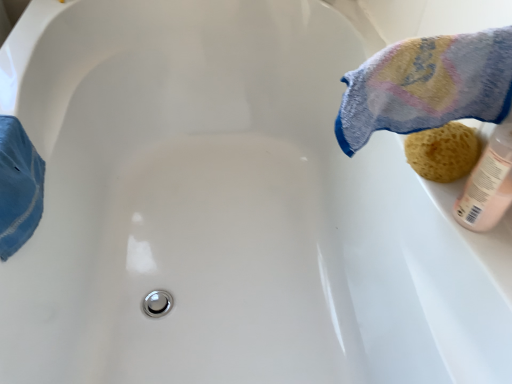
What is the approximate width of yellow sponge at right?

The width of yellow sponge at right is 9.50 centimeters.

This screenshot has width=512, height=384. In order to click on yellow sponge at right in this screenshot , I will do `click(443, 152)`.

What do you see at coordinates (443, 152) in the screenshot? The width and height of the screenshot is (512, 384). I see `yellow sponge at right` at bounding box center [443, 152].

Find the location of a particular element. Image resolution: width=512 pixels, height=384 pixels. multicolored terry cloth towel at upper right is located at coordinates (426, 86).

What do you see at coordinates (426, 86) in the screenshot?
I see `multicolored terry cloth towel at upper right` at bounding box center [426, 86].

Find the location of a particular element. Image resolution: width=512 pixels, height=384 pixels. yellow sponge at right is located at coordinates (443, 152).

Considering the relative positions of yellow sponge at right and multicolored terry cloth towel at upper right in the image provided, is yellow sponge at right to the right of multicolored terry cloth towel at upper right from the viewer's perspective?

Indeed, yellow sponge at right is positioned on the right side of multicolored terry cloth towel at upper right.

Considering their positions, is yellow sponge at right located in front of or behind multicolored terry cloth towel at upper right?

In the image, yellow sponge at right appears behind multicolored terry cloth towel at upper right.

Considering the positions of point (438, 163) and point (383, 121), is point (438, 163) closer or farther from the camera than point (383, 121)?

Point (438, 163).

From the image's perspective, relative to multicolored terry cloth towel at upper right, is yellow sponge at right above or below?

Based on their image positions, yellow sponge at right is located beneath multicolored terry cloth towel at upper right.

From a real-world perspective, is yellow sponge at right on multicolored terry cloth towel at upper right?

Actually, yellow sponge at right is physically below multicolored terry cloth towel at upper right in the real world.

Considering the sizes of objects yellow sponge at right and multicolored terry cloth towel at upper right in the image provided, who is wider, yellow sponge at right or multicolored terry cloth towel at upper right?

multicolored terry cloth towel at upper right.

Can you confirm if yellow sponge at right is taller than multicolored terry cloth towel at upper right?

In fact, yellow sponge at right may be shorter than multicolored terry cloth towel at upper right.

Can you confirm if yellow sponge at right is bigger than multicolored terry cloth towel at upper right?

Incorrect, yellow sponge at right is not larger than multicolored terry cloth towel at upper right.

Is multicolored terry cloth towel at upper right surrounded by yellow sponge at right?

No, yellow sponge at right does not contain multicolored terry cloth towel at upper right.

Is yellow sponge at right far from multicolored terry cloth towel at upper right?

No, yellow sponge at right is not far from multicolored terry cloth towel at upper right.

Is yellow sponge at right aimed at multicolored terry cloth towel at upper right?

No.

Find the location of a particular element. stuff that appears on the right of multicolored terry cloth towel at upper right is located at coordinates (443, 152).

Considering the positions of objects multicolored terry cloth towel at upper right and yellow sponge at right in the image provided, who is more to the right, multicolored terry cloth towel at upper right or yellow sponge at right?

From the viewer's perspective, yellow sponge at right appears more on the right side.

Is multicolored terry cloth towel at upper right positioned in front of yellow sponge at right?

Yes, it is.

Considering the positions of points (440, 43) and (452, 158), is point (440, 43) closer to camera compared to point (452, 158)?

Yes.

From the picture: From the image's perspective, is multicolored terry cloth towel at upper right located above or below yellow sponge at right?

multicolored terry cloth towel at upper right is above yellow sponge at right.

Looking at this image, from a real-world perspective, relative to yellow sponge at right, is multicolored terry cloth towel at upper right vertically above or below?

multicolored terry cloth towel at upper right is situated higher than yellow sponge at right in the real world.

Does multicolored terry cloth towel at upper right have a lesser width compared to yellow sponge at right?

No.

Who is taller, multicolored terry cloth towel at upper right or yellow sponge at right?

Standing taller between the two is multicolored terry cloth towel at upper right.

Who is bigger, multicolored terry cloth towel at upper right or yellow sponge at right?

multicolored terry cloth towel at upper right is bigger.

Is multicolored terry cloth towel at upper right not within yellow sponge at right?

multicolored terry cloth towel at upper right lies outside yellow sponge at right's area.

Is there a large distance between multicolored terry cloth towel at upper right and yellow sponge at right?

They are positioned close to each other.

Could you tell me if multicolored terry cloth towel at upper right is facing yellow sponge at right?

No, multicolored terry cloth towel at upper right is not aimed at yellow sponge at right.

You are a GUI agent. You are given a task and a screenshot of the screen. Output one action in this format:
    pyautogui.click(x=<x>, y=<y>)
    Task: Click on the stuff directly beneath the multicolored terry cloth towel at upper right (from a real-world perspective)
    
    Given the screenshot: What is the action you would take?
    pyautogui.click(x=443, y=152)

Locate an element on the screen. The width and height of the screenshot is (512, 384). bath towel lying above the yellow sponge at right (from the image's perspective) is located at coordinates (426, 86).

Locate an element on the screen. The image size is (512, 384). bath towel above the yellow sponge at right (from a real-world perspective) is located at coordinates (426, 86).